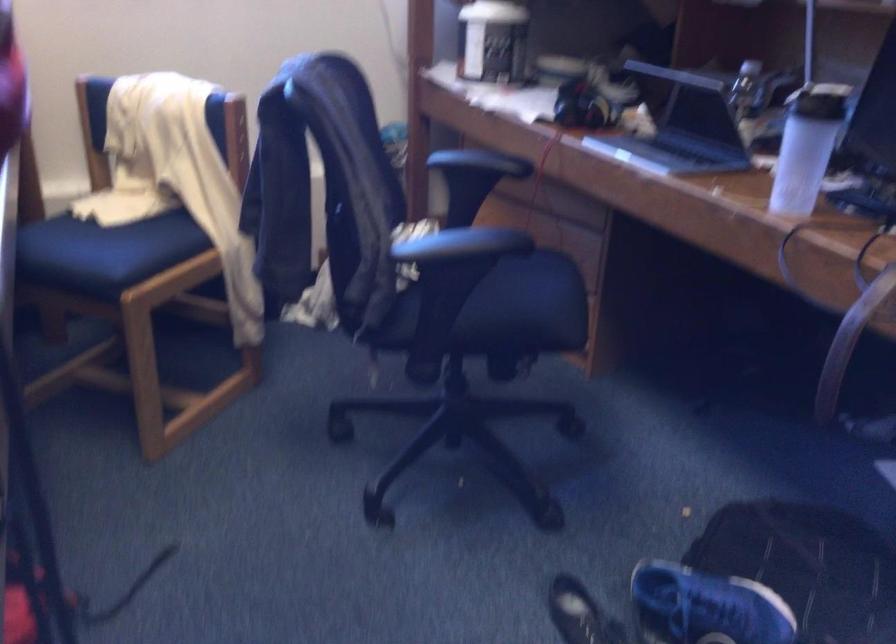
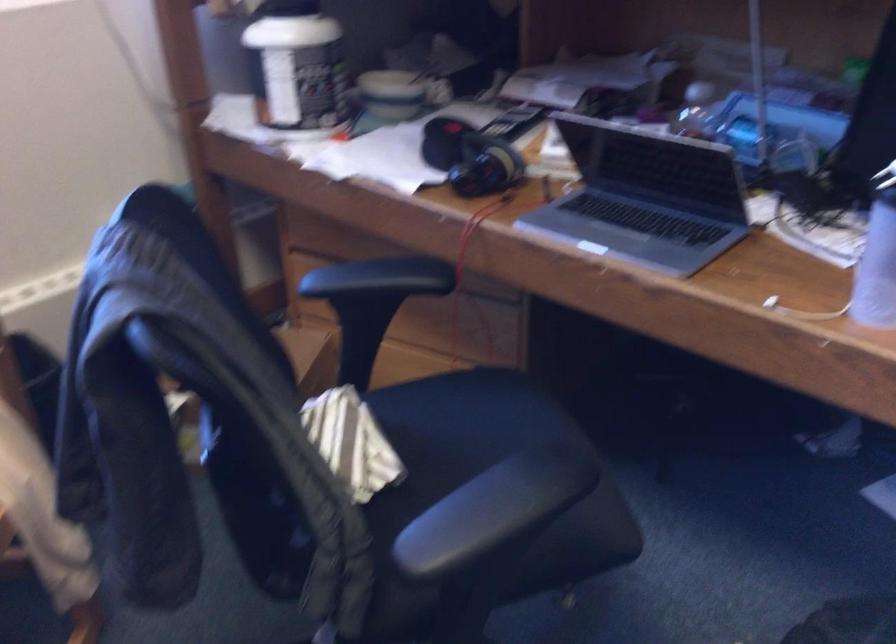
Find the pixel in the second image that matches point 503,263 in the first image.

(461, 424)